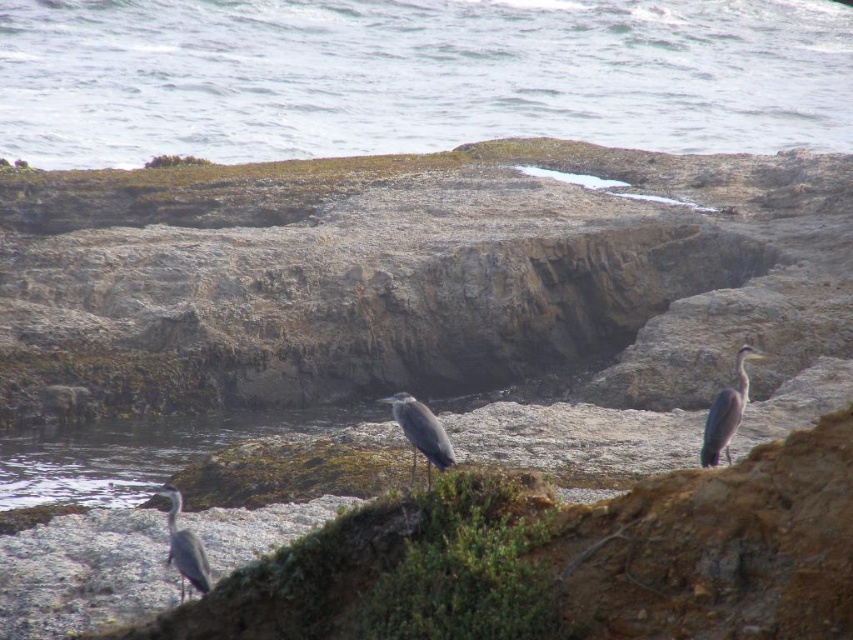
Question: Among these points, which one is farthest from the camera?

Choices:
 (A) (196, 545)
 (B) (80, 44)

Answer: (B)

Question: Among these points, which one is farthest from the camera?

Choices:
 (A) (718, 428)
 (B) (554, 76)
 (C) (439, 444)
 (D) (189, 580)

Answer: (B)

Question: Is gray matte heron at right behind gray matte bird at center?

Choices:
 (A) yes
 (B) no

Answer: (A)

Question: Which point is farther to the camera?

Choices:
 (A) (740, 372)
 (B) (666, 36)

Answer: (B)

Question: Is gray matte bird at center closer to the viewer compared to gray matte heron at lower left?

Choices:
 (A) yes
 (B) no

Answer: (B)

Question: Is clear water at center to the left of gray matte heron at lower left from the viewer's perspective?

Choices:
 (A) no
 (B) yes

Answer: (A)